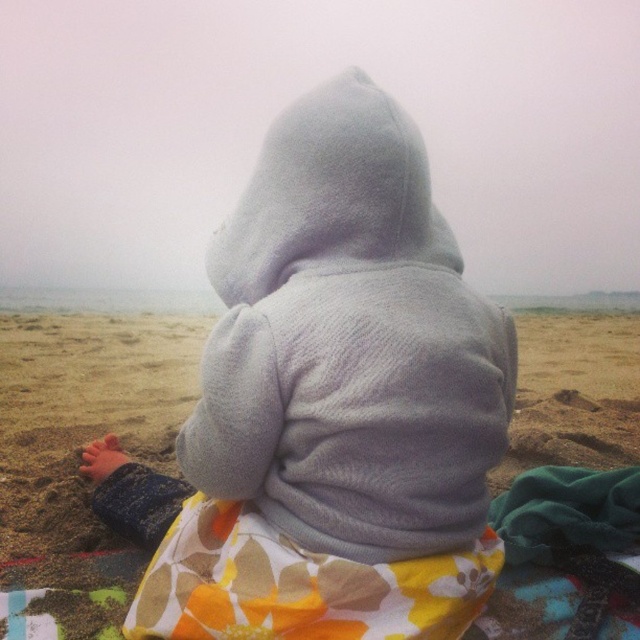
You are a photographer trying to capture the scene. You notice the gray fleece hoodie at center and the soft sand at center. Based on their positions, which object is closer to the right edge of the image?

The soft sand at center is closer to the right edge of the image because the gray fleece hoodie at center is to the left of it.

You are a photographer trying to capture the exact position of the gray fleece hoodie at center in the image. If the image is divided into a grid with coordinates from 0 to 1 on both the x and y axes, what are the coordinates of the hoodie?

The coordinates of the gray fleece hoodie at center are at point (349, 342).

You are a photographer trying to capture a closeup shot of both the gray fleece hoodie at center and the printed cotton blanket at center. The camera you are using has a maximum focus range of 20 centimeters. Can you fit both objects within the camera focus range without moving the camera?

The gray fleece hoodie at center and printed cotton blanket at center are 19.72 centimeters apart from each other. Since the distance between them is less than the camera maximum focus range of 20 centimeters, you can fit both objects within the camera focus range without moving the camera.